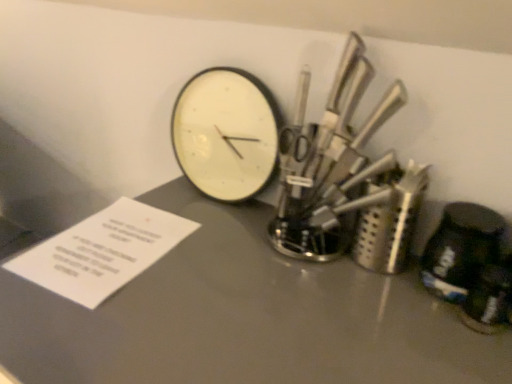
Image resolution: width=512 pixels, height=384 pixels. I want to click on vacant space in front of white matte wall clock at center, so click(212, 251).